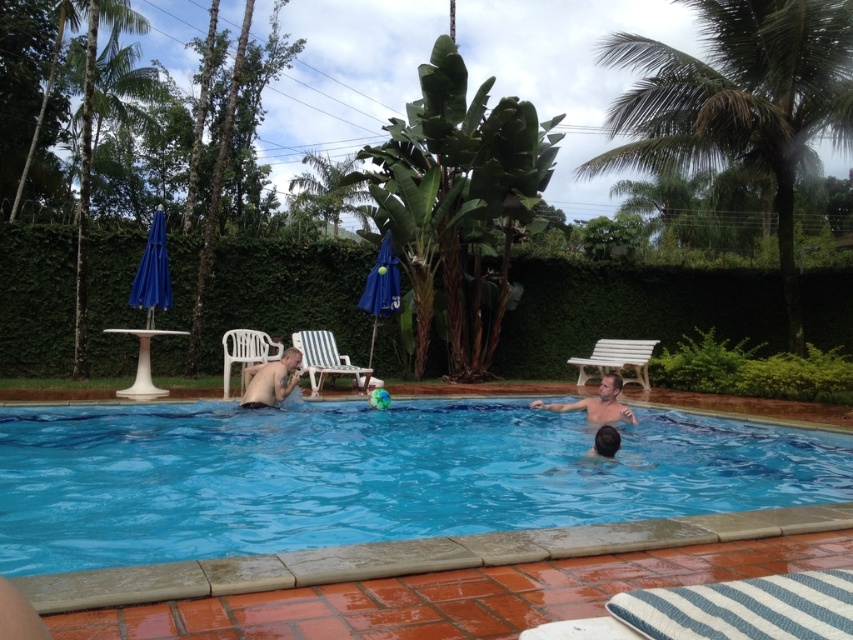
Question: Which point is closer to the camera taking this photo?

Choices:
 (A) (364, 380)
 (B) (579, 404)

Answer: (B)

Question: Among these objects, which one is farthest from the camera?

Choices:
 (A) green leafy palm tree at upper right
 (B) white plastic bench at center
 (C) white plastic chair at left
 (D) white striped plastic chair at center

Answer: (B)

Question: Among these points, which one is farthest from the camera?

Choices:
 (A) (627, 360)
 (B) (317, 360)
 (C) (254, 365)

Answer: (A)

Question: Is the position of blue smooth water at center more distant than that of green leafy palm tree at upper right?

Choices:
 (A) no
 (B) yes

Answer: (A)

Question: Does blue smooth water at center have a lesser width compared to white striped plastic chair at center?

Choices:
 (A) no
 (B) yes

Answer: (B)

Question: Considering the relative positions of green leafy palm tree at upper right and white striped plastic chair at center in the image provided, where is green leafy palm tree at upper right located with respect to white striped plastic chair at center?

Choices:
 (A) left
 (B) right

Answer: (B)